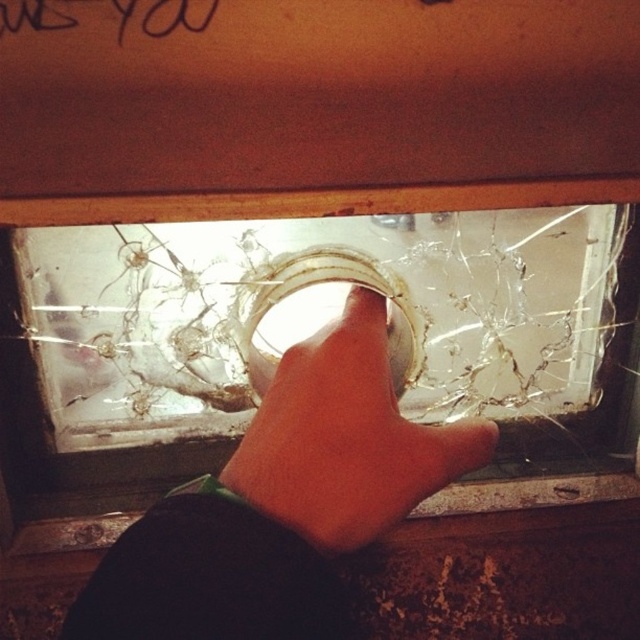
You are a repair technician assessing a damaged window. You notice the transparent glass window at center and the light skin hand at center in the image. Based on their sizes, can you determine if the hand is entirely within the boundaries of the window?

The transparent glass window at center is wider than the light skin hand at center, so the hand is entirely within the boundaries of the window.

Consider the image. You are a repair technician assessing a damaged glass panel. The glass is part of a wooden framed window. You notice a point marked at coordinates (282, 502). Based on the scene description, what object or feature does this point correspond to?

The point at coordinates (282, 502) corresponds to the light skin hand at center, indicating where the hand is touching the damaged glass surface.